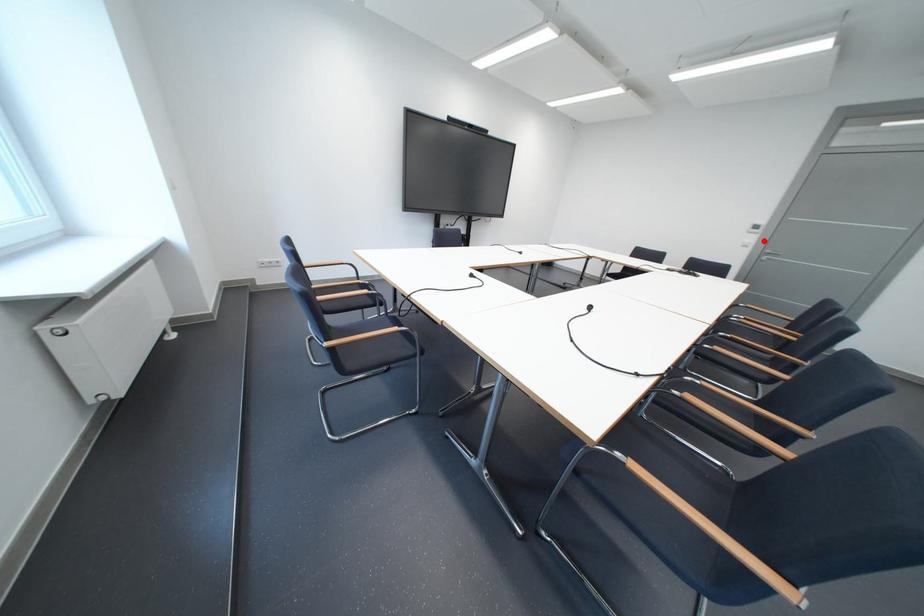
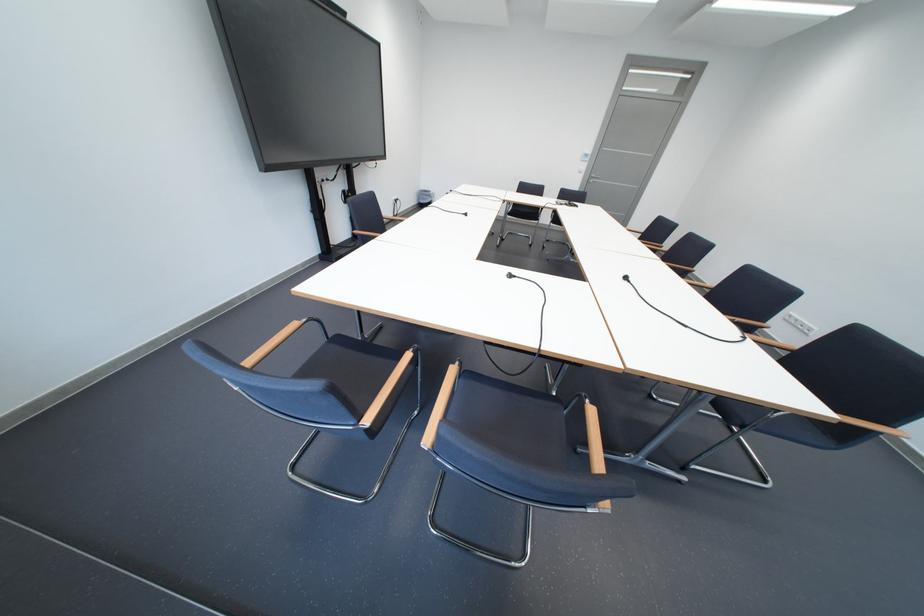
Question: I am providing you with two images of the same scene from different viewpoints. A red point is shown in image1. For the corresponding object point in image2, is it positioned nearer or farther from the camera?

Choices:
 (A) Nearer
 (B) Farther

Answer: (A)